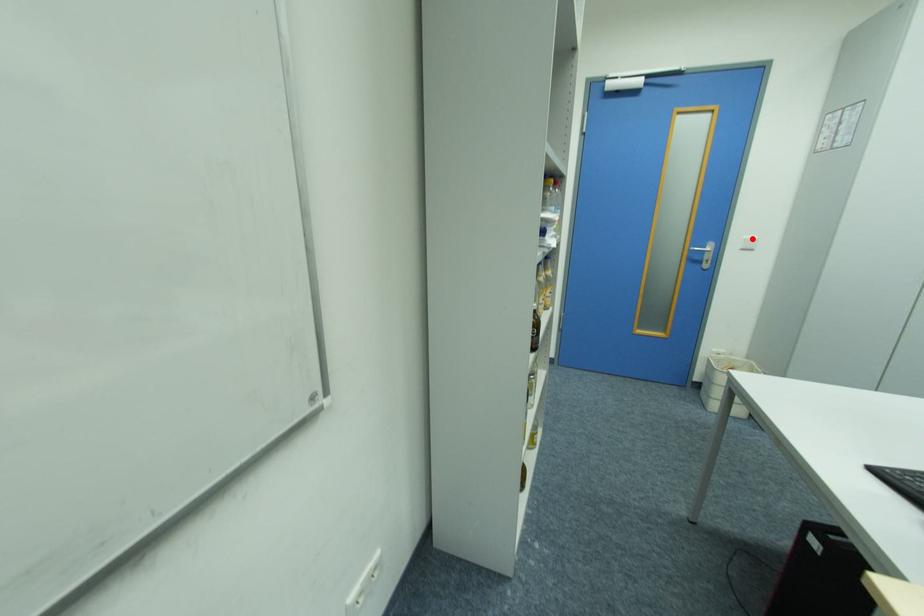
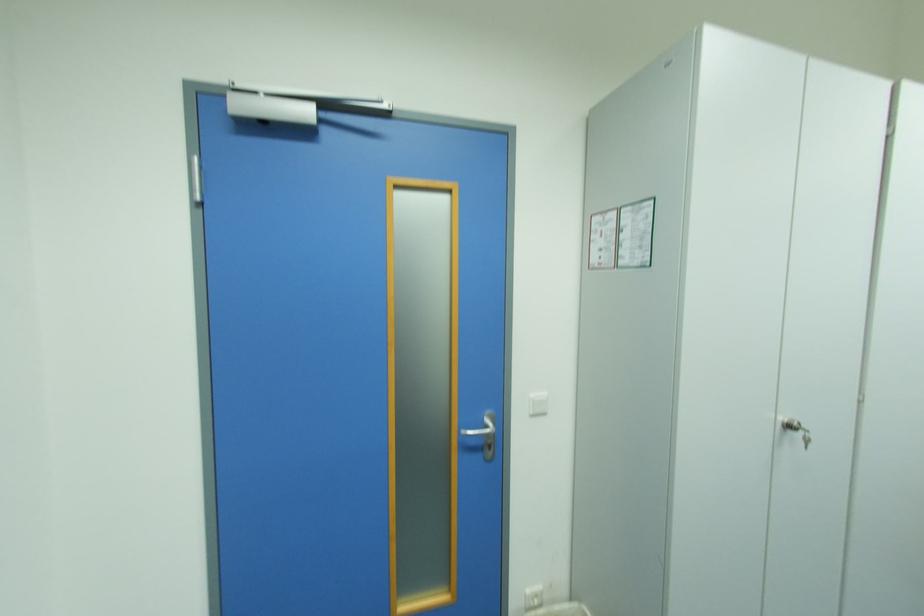
Where in the second image is the point corresponding to the highlighted location from the first image?

(540, 395)